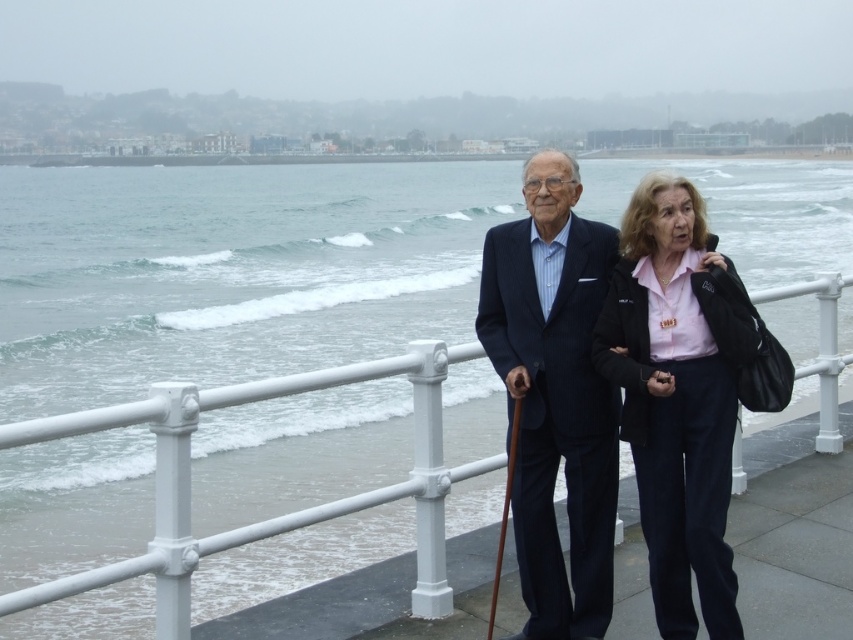
You are a photographer standing on the seaside promenade. You want to take a photo of the pink matte shirt at center and the white metal railing at center. If your camera has a maximum focus range of 1.5 meters, will both subjects be in focus?

The pink matte shirt at center is 1.83 meters from the white metal railing at center. Since the camera can only focus up to 1.5 meters, the two subjects are too far apart for both to be in focus simultaneously.

You are standing on the seaside promenade and want to take a photo of both the point at coordinates (695, 298) and the point at (407, 481). Which point should you focus on first to ensure both are in sharp focus?

You should focus on the point at coordinates (695, 298) first because it is closer to the viewer than the point at (407, 481). This ensures the closer point is in focus, and the farther point will also be sharp due to depth of field.

You are a photographer trying to capture a portrait of the dark blue pinstripe suit at center and the white metal railing at center. Which object should you focus on first if you want to ensure both are in sharp focus?

The dark blue pinstripe suit at center is much taller than the white metal railing at center, so focusing on the suit first would help ensure both are in sharp focus.